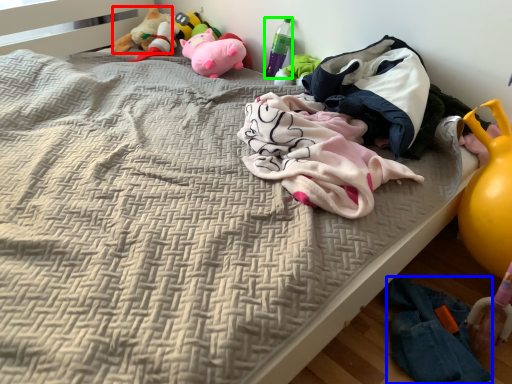
Question: Considering the real-world distances, which object is farthest from toy (highlighted by a red box)? clothing (highlighted by a blue box) or bottle (highlighted by a green box)?

Choices:
 (A) clothing
 (B) bottle

Answer: (A)